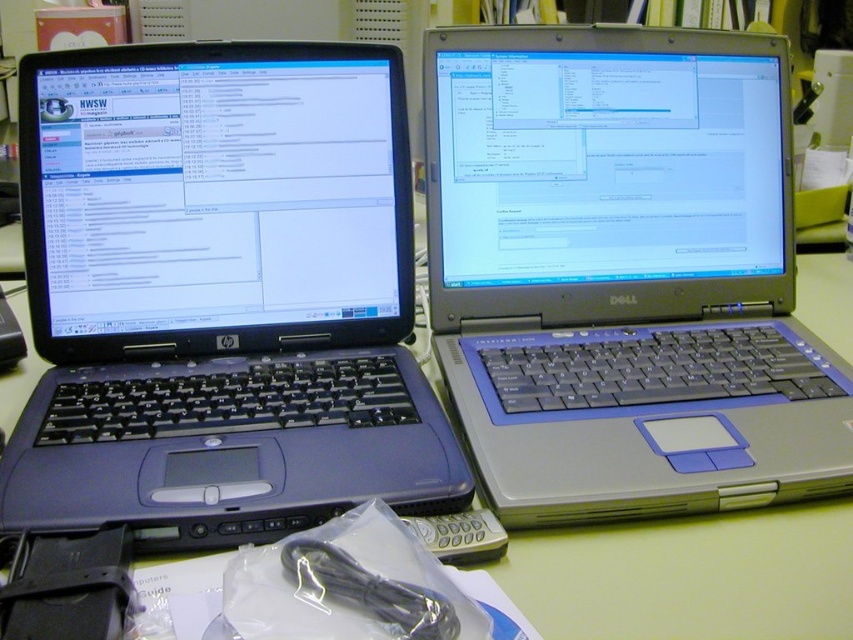
You are setting up a new monitor that requires at least 10 inches of vertical space. You have the matte black laptop at left and the matte plastic computer desk at center. Which object provides enough vertical space for the monitor?

The matte black laptop at left is much taller than the matte plastic computer desk at center, so it provides enough vertical space for the monitor.

You are organizing a tech event and need to arrange these two laptops for a presentation. The HP laptop needs to be positioned to the left of the Dell laptop. Are the current positions of the matte black laptop at left and the silver metallic laptop at upper right aligned correctly for this requirement?

The matte black laptop at left is already positioned to the left of the silver metallic laptop at upper right, so the current arrangement meets the requirement.